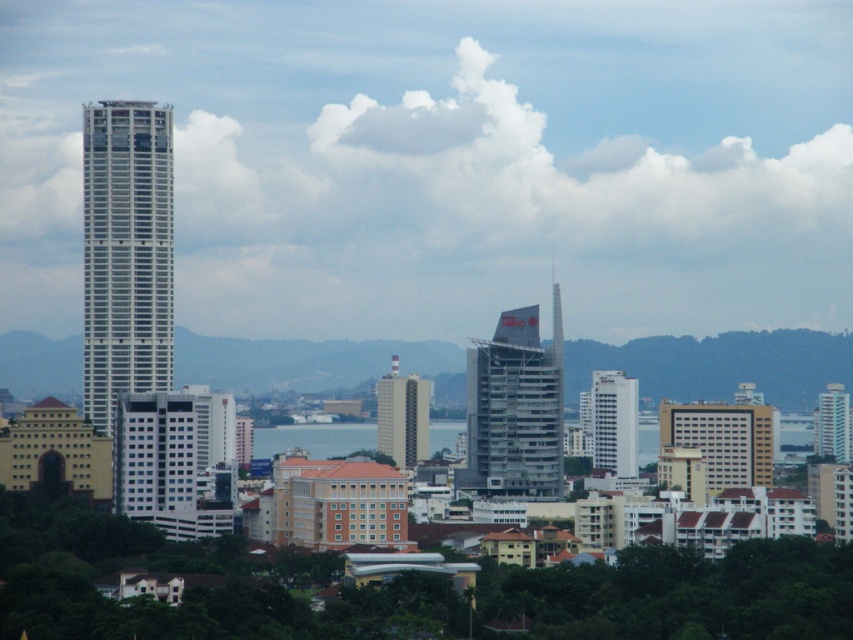
Question: Does metallic glass skyscraper at center have a lesser width compared to matte beige building at center?

Choices:
 (A) no
 (B) yes

Answer: (A)

Question: Among these objects, which one is farthest from the camera?

Choices:
 (A) blue water at center
 (B) matte beige building at center
 (C) white glass tower at left
 (D) white glossy building at center

Answer: (C)

Question: Among these objects, which one is nearest to the camera?

Choices:
 (A) metallic glass skyscraper at center
 (B) matte beige building at center
 (C) white glossy building at center

Answer: (A)

Question: From the image, what is the correct spatial relationship of white glass tower at left in relation to matte beige building at center?

Choices:
 (A) left
 (B) right

Answer: (A)

Question: Does metallic glass skyscraper at center have a lesser width compared to white glossy building at center?

Choices:
 (A) no
 (B) yes

Answer: (A)

Question: Which is nearer to the white glossy building at center?

Choices:
 (A) matte beige building at center
 (B) white glass building at right
 (C) white fluffy cloud at upper center

Answer: (A)